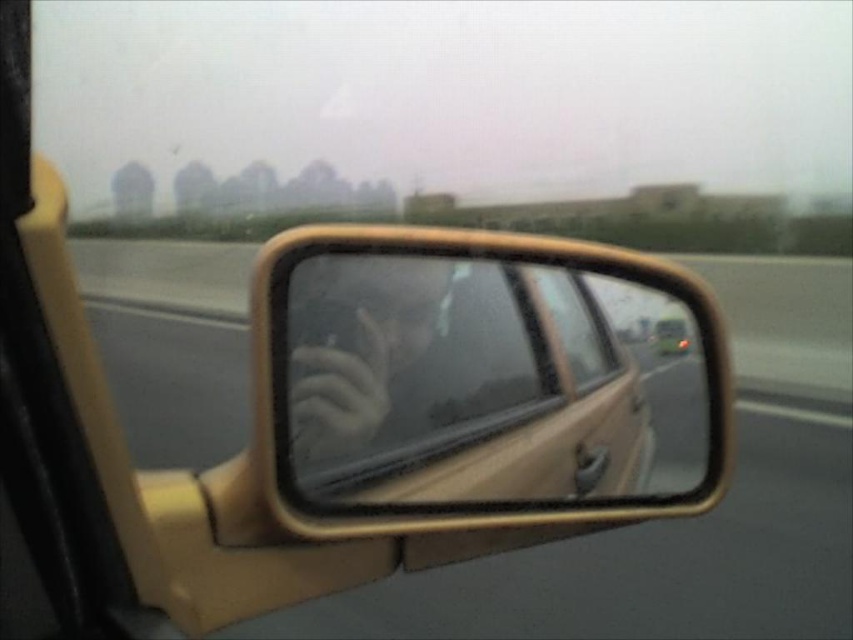
Question: Does matte yellow mirror at center have a larger size compared to matte black car at center?

Choices:
 (A) yes
 (B) no

Answer: (A)

Question: Which object appears farthest from the camera in this image?

Choices:
 (A) matte yellow mirror at center
 (B) clear glass car window at center

Answer: (B)

Question: Which of the following is the farthest from the observer?

Choices:
 (A) matte yellow mirror at center
 (B) matte black car at center
 (C) frosted glass hand at center
 (D) clear glass car window at center

Answer: (B)

Question: Which point is farther to the camera?

Choices:
 (A) matte yellow mirror at center
 (B) clear glass car window at center

Answer: (B)

Question: Where is matte yellow mirror at center located in relation to frosted glass hand at center in the image?

Choices:
 (A) below
 (B) above

Answer: (A)

Question: Observing the image, what is the correct spatial positioning of matte yellow mirror at center in reference to clear glass car window at center?

Choices:
 (A) above
 (B) below

Answer: (B)